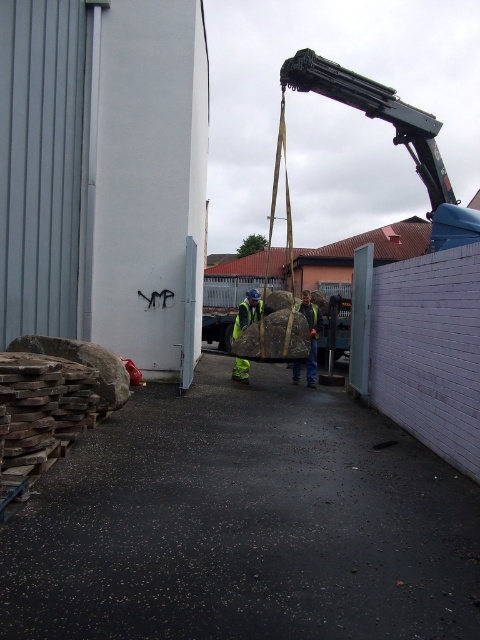
Is point (358, 628) positioned before point (308, 385)?

Yes, it is in front of point (308, 385).

Based on the photo, can you confirm if smooth concrete alley at center is positioned to the left of reflective yellow safety vest at center?

Indeed, smooth concrete alley at center is positioned on the left side of reflective yellow safety vest at center.

Is point (48, 548) more distant than point (305, 317)?

No, it is in front of (305, 317).

Where is `smooth concrete alley at center`? This screenshot has height=640, width=480. smooth concrete alley at center is located at coordinates (243, 524).